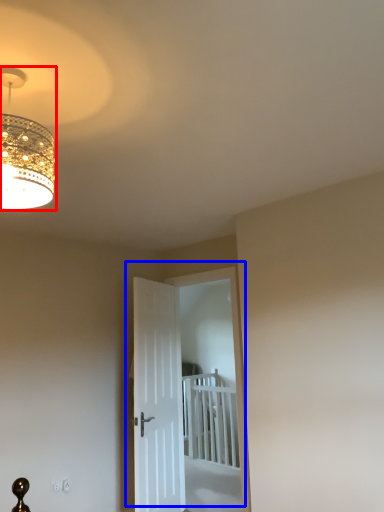
Question: Which object is further to the camera taking this photo, lamp (highlighted by a red box) or door (highlighted by a blue box)?

Choices:
 (A) lamp
 (B) door

Answer: (B)